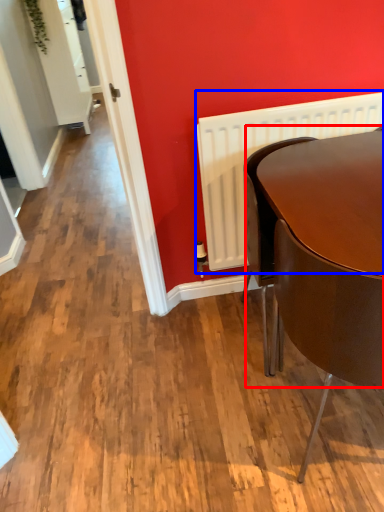
Question: Among these objects, which one is farthest to the camera, round table (highlighted by a red box) or radiator (highlighted by a blue box)?

Choices:
 (A) round table
 (B) radiator

Answer: (B)